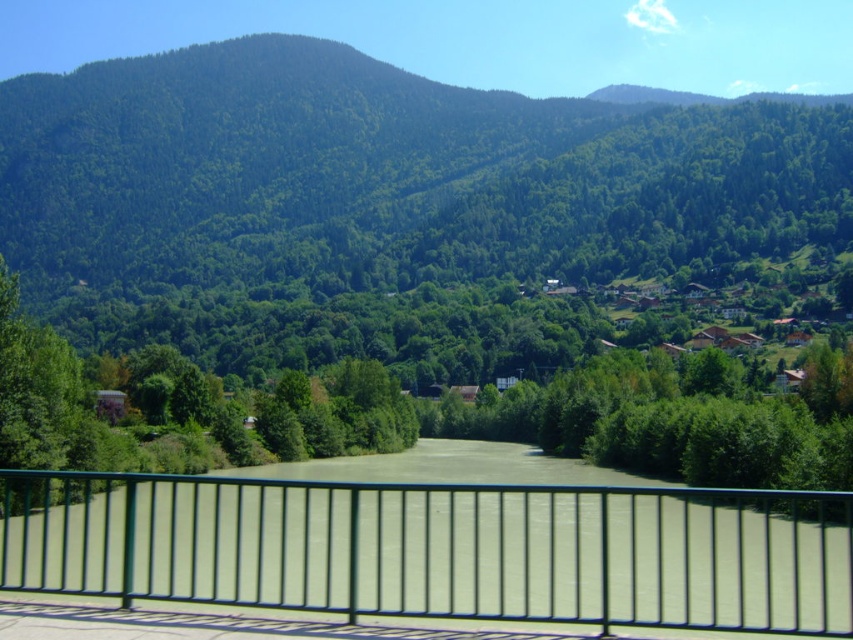
You are standing at the edge of a bridge overlooking the river and want to take a photo of the black metal fence at center. If your camera has a maximum focus range of 7 meters, will it be able to capture the fence clearly?

The black metal fence at center is 6.94 meters away from the camera, which is within the 7 meters maximum focus range. Therefore, the camera should be able to capture the fence clearly.

From the picture: You are standing on the metal railing in the foreground and want to take a photo of both the green forested mountain at upper center and the green leafy tree at center. Which object will appear larger in the photo?

The green forested mountain at upper center will appear larger in the photo because it is taller than the green leafy tree at center.

You are standing at the metal railing in the foreground of the scene. You notice two points in the image labeled as point 1 at coordinates point [234,538] and point 2 at coordinates point [39,333]. Which point is closer to you?

Point [234,538] is closer to the camera than point [39,333], so point 1 at coordinates point [234,538] is closer to you.